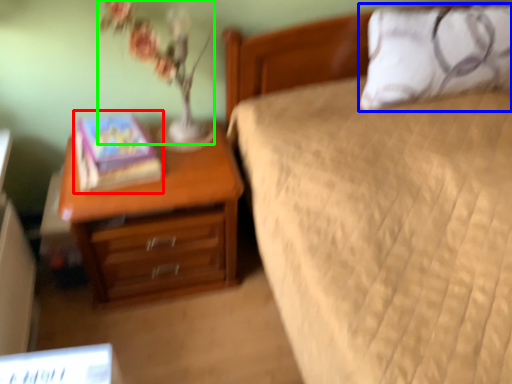
Question: Based on their relative distances, which object is farther from book (highlighted by a red box)? Choose from pillow (highlighted by a blue box) and floral arrangement (highlighted by a green box).

Choices:
 (A) pillow
 (B) floral arrangement

Answer: (A)